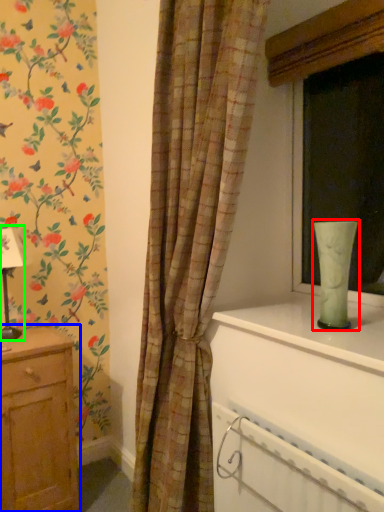
Question: Based on their relative distances, which object is farther from glass vase (highlighted by a red box)? Choose from chest of drawers (highlighted by a blue box) and table lamp (highlighted by a green box).

Choices:
 (A) chest of drawers
 (B) table lamp

Answer: (B)